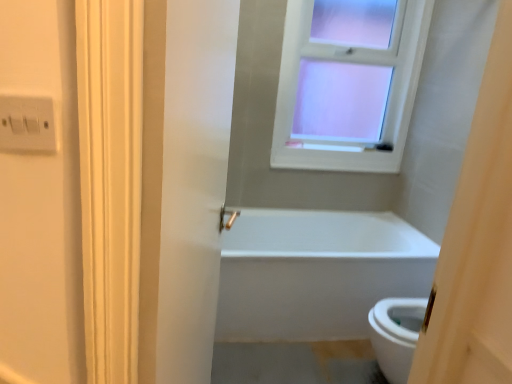
Find the location of `white matte door at right`. white matte door at right is located at coordinates (477, 243).

The width and height of the screenshot is (512, 384). What do you see at coordinates (477, 243) in the screenshot? I see `white matte door at right` at bounding box center [477, 243].

What is the approximate height of white matte door at right?

1.45 meters.

You are a GUI agent. You are given a task and a screenshot of the screen. Output one action in this format:
    pyautogui.click(x=<x>, y=<y>)
    Task: Click on the white matte door at right
    The width and height of the screenshot is (512, 384).
    Given the screenshot: What is the action you would take?
    pyautogui.click(x=477, y=243)